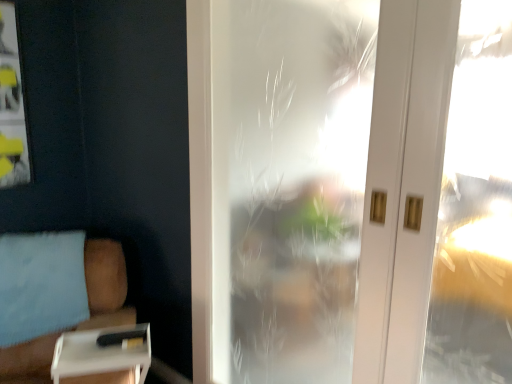
Locate an element on the screen. This screenshot has height=384, width=512. frosted glass door at center is located at coordinates (351, 190).

Considering the relative positions of white plastic tray at lower left and white matte box at lower left in the image provided, is white plastic tray at lower left to the left of white matte box at lower left from the viewer's perspective?

In fact, white plastic tray at lower left is to the right of white matte box at lower left.

Does white plastic tray at lower left turn towards white matte box at lower left?

Yes, white plastic tray at lower left is aimed at white matte box at lower left.

Which object is closer to the camera taking this photo, white plastic tray at lower left or white matte box at lower left?

white matte box at lower left is in front.

You are a GUI agent. You are given a task and a screenshot of the screen. Output one action in this format:
    pyautogui.click(x=<x>, y=<y>)
    Task: Click on the furniture directly beneath the frosted glass door at center (from a real-world perspective)
    
    Given the screenshot: What is the action you would take?
    pyautogui.click(x=54, y=296)

Which of these two, frosted glass door at center or white matte box at lower left, is bigger?

Bigger between the two is white matte box at lower left.

How different are the orientations of frosted glass door at center and white matte box at lower left in degrees?

The facing directions of frosted glass door at center and white matte box at lower left are 52.2 degrees apart.

Is frosted glass door at center positioned with its back to white matte box at lower left?

frosted glass door at center does not have its back to white matte box at lower left.

Which is correct: white plastic tray at lower left is inside frosted glass door at center, or outside of it?

white plastic tray at lower left is not inside frosted glass door at center, it's outside.

Which object is wider, white plastic tray at lower left or frosted glass door at center?

white plastic tray at lower left.

Which is in front, point (100, 369) or point (424, 298)?

Point (424, 298)

Is frosted glass door at center looking in the opposite direction of white plastic tray at lower left?

No, white plastic tray at lower left is not at the back of frosted glass door at center.

From the image's perspective, who appears lower, frosted glass door at center or white plastic tray at lower left?

From the image's view, white plastic tray at lower left is below.

How different are the orientations of frosted glass door at center and white plastic tray at lower left in degrees?

They differ by 55.7 degrees in their facing directions.

Who is more distant, frosted glass door at center or white plastic tray at lower left?

white plastic tray at lower left is more distant.

From the image's perspective, between white matte box at lower left and frosted glass door at center, who is located below?

white matte box at lower left appears lower in the image.

Is white matte box at lower left not within frosted glass door at center?

Absolutely, white matte box at lower left is external to frosted glass door at center.

Is white matte box at lower left in contact with frosted glass door at center?

white matte box at lower left and frosted glass door at center are clearly separated.

Based on their positions, is white matte box at lower left located to the left or right of white plastic tray at lower left?

In the image, white matte box at lower left appears on the left side of white plastic tray at lower left.

Is white plastic tray at lower left at the back of white matte box at lower left?

No, white matte box at lower left's orientation is not away from white plastic tray at lower left.

From a real-world perspective, who is located higher, white matte box at lower left or white plastic tray at lower left?

white plastic tray at lower left is physically above.

Is point (1, 362) closer to camera compared to point (57, 351)?

No, it is behind (57, 351).

In the image, there is a white plastic tray at lower left. Where is `furniture below it (from the image's perspective)`? This screenshot has width=512, height=384. furniture below it (from the image's perspective) is located at coordinates (54, 296).

Identify the location of window above the white matte box at lower left (from a real-world perspective). (351, 190).

Based on their spatial positions, is white matte box at lower left or frosted glass door at center closer to white plastic tray at lower left?

Among the two, white matte box at lower left is located nearer to white plastic tray at lower left.

From the image, which object appears to be farther from white plastic tray at lower left, frosted glass door at center or white matte box at lower left?

Based on the image, frosted glass door at center appears to be further to white plastic tray at lower left.

Looking at the image, which one is located closer to frosted glass door at center, white plastic tray at lower left or white matte box at lower left?

The object closer to frosted glass door at center is white matte box at lower left.

Based on their spatial positions, is white plastic tray at lower left or frosted glass door at center closer to white matte box at lower left?

Among the two, white plastic tray at lower left is located nearer to white matte box at lower left.

When comparing their distances from white matte box at lower left, does frosted glass door at center or white plastic tray at lower left seem further?

Based on the image, frosted glass door at center appears to be further to white matte box at lower left.

From the picture: Estimate the real-world distances between objects in this image. Which object is further from frosted glass door at center, white matte box at lower left or white plastic tray at lower left?

white plastic tray at lower left.

Locate an element on the screen. The height and width of the screenshot is (384, 512). table situated between white matte box at lower left and frosted glass door at center from left to right is located at coordinates (103, 356).